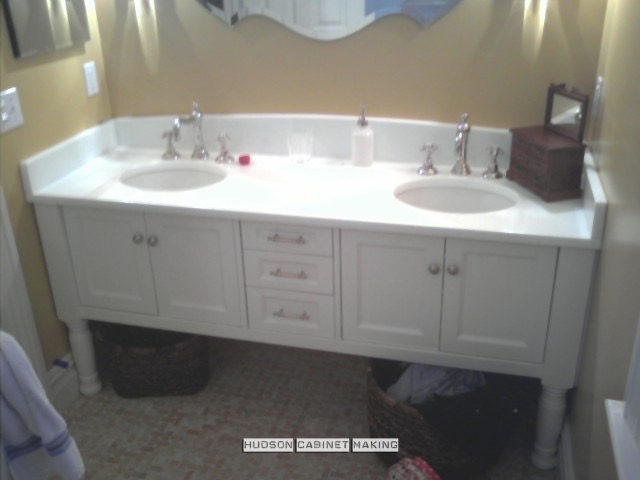
At what (x,y) coordinates should I click in order to perform the action: click on door handle. Please return your answer as a coordinate pair (x, y). This screenshot has width=640, height=480. Looking at the image, I should click on (436, 268).